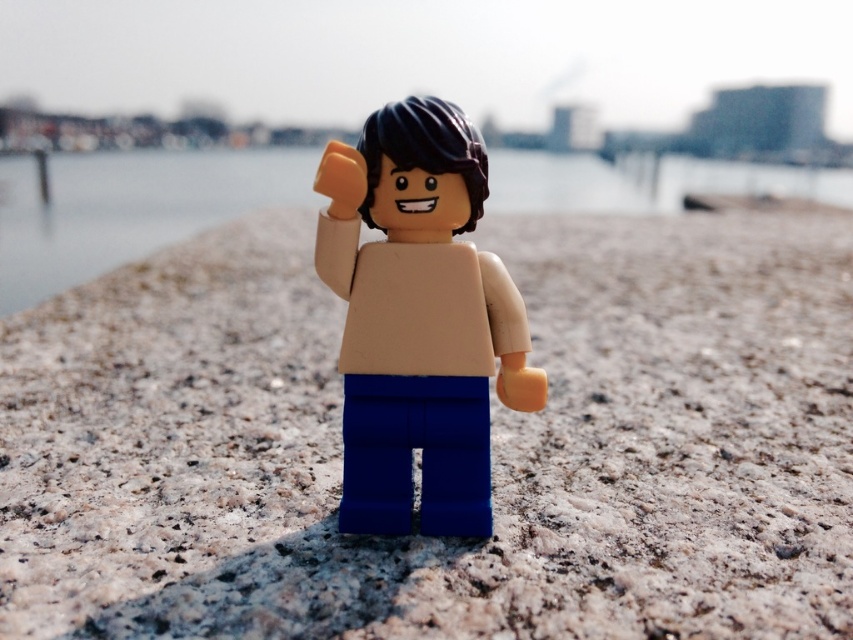
Question: Which point is closer to the camera?

Choices:
 (A) (397, 628)
 (B) (88, 200)
 (C) (397, 520)

Answer: (A)

Question: Does smooth sand at center have a lesser width compared to clear water at center?

Choices:
 (A) no
 (B) yes

Answer: (A)

Question: In this image, where is smooth sand at center located relative to clear water at center?

Choices:
 (A) below
 (B) above

Answer: (A)

Question: Is smooth sand at center further to the viewer compared to clear water at center?

Choices:
 (A) yes
 (B) no

Answer: (B)

Question: Estimate the real-world distances between objects in this image. Which object is farther from the matte plastic minifigure at center?

Choices:
 (A) clear water at center
 (B) smooth sand at center

Answer: (A)

Question: Which of the following is the closest to the observer?

Choices:
 (A) (465, 416)
 (B) (184, 177)
 (C) (102, 282)

Answer: (A)